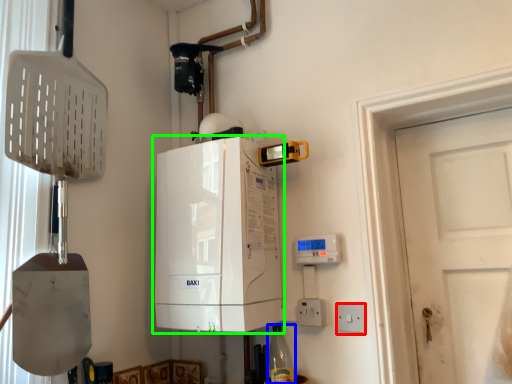
Question: Which object is the farthest from electric outlet (highlighted by a red box)? Choose among these: bottle (highlighted by a blue box) or home appliance (highlighted by a green box).

Choices:
 (A) bottle
 (B) home appliance

Answer: (B)